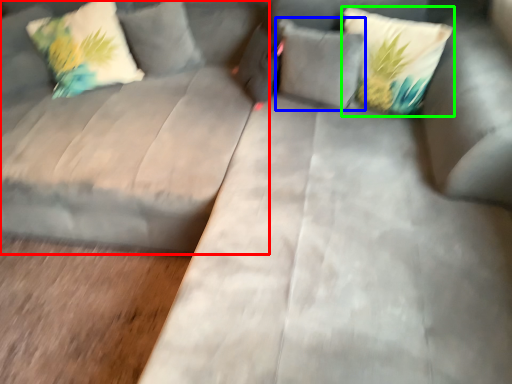
Question: Which is farther away from couch (highlighted by a red box)? pillow (highlighted by a blue box) or pillow (highlighted by a green box)?

Choices:
 (A) pillow
 (B) pillow

Answer: (B)